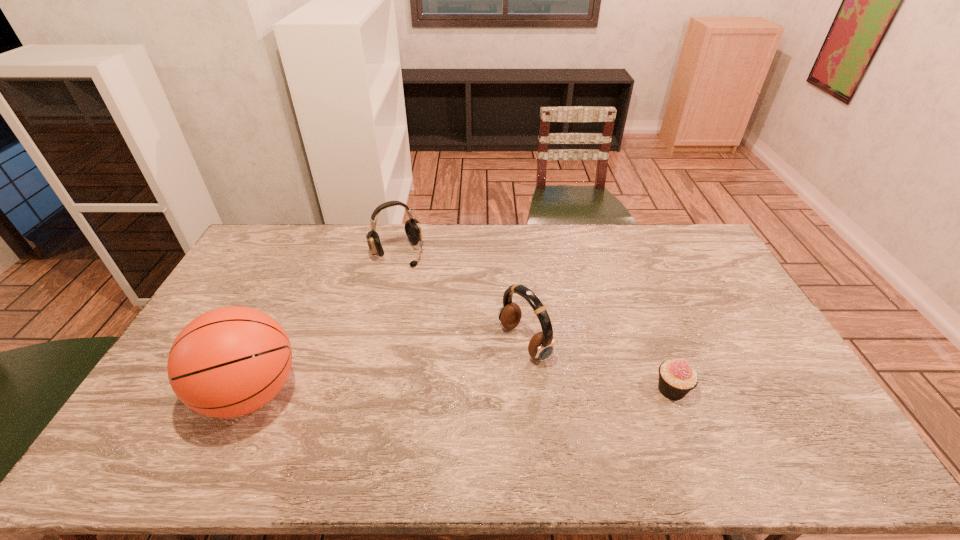
Where is `vacant region located on the ear cup of the nearer headset`? This screenshot has height=540, width=960. vacant region located on the ear cup of the nearer headset is located at coordinates (420, 399).

Where is `vacant area situated 0.360m on the ear cup of the nearer headset`? The height and width of the screenshot is (540, 960). vacant area situated 0.360m on the ear cup of the nearer headset is located at coordinates (390, 414).

Identify the location of blank area located 0.370m on the ear cup of the nearer headset. (386, 416).

I want to click on free space located 0.230m with the microphone on the side of the third object from right to left, so click(x=436, y=305).

In order to click on free region located 0.140m with the microphone on the side of the third object from right to left in this screenshot , I will do tap(424, 289).

Where is `free spot located with the microphone on the side of the third object from right to left`? The image size is (960, 540). free spot located with the microphone on the side of the third object from right to left is located at coordinates (430, 298).

At what (x,y) coordinates should I click in order to perform the action: click on object located at the far edge. Please return your answer as a coordinate pair (x, y). This screenshot has width=960, height=540. Looking at the image, I should click on (412, 227).

Locate an element on the screen. This screenshot has width=960, height=540. basketball located in the near edge section of the desktop is located at coordinates (228, 362).

What are the coordinates of `cupcake that is positioned at the near edge` in the screenshot? It's located at (676, 377).

This screenshot has width=960, height=540. What are the coordinates of `object present at the left edge` in the screenshot? It's located at (228, 362).